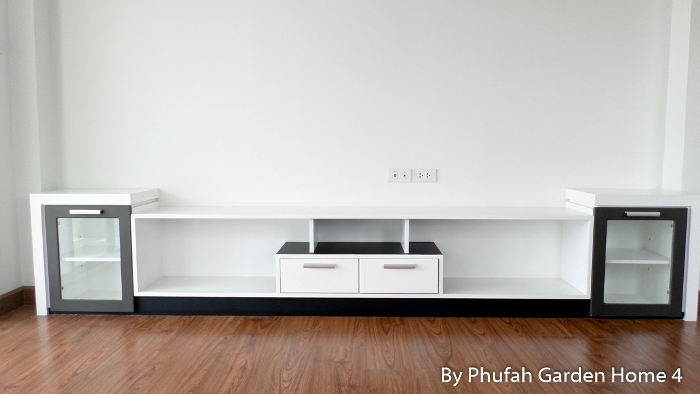
Where is `shelf`? This screenshot has height=394, width=700. shelf is located at coordinates (497, 304).